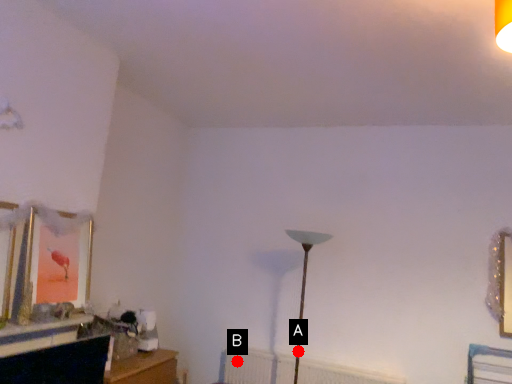
Question: Two points are circled on the image, labeled by A and B beside each circle. Which point is closer to the camera?

Choices:
 (A) A is closer
 (B) B is closer

Answer: (A)